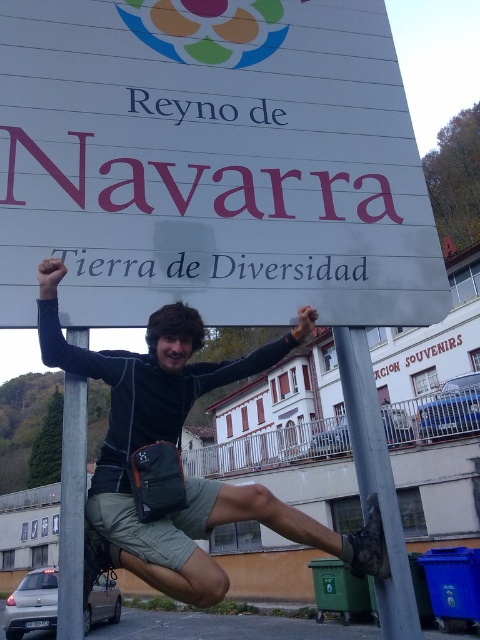
Question: Considering the real-world distances, which object is farthest from the white plastic sign at upper center?

Choices:
 (A) metallic pole at lower center
 (B) metallic pole at left

Answer: (B)

Question: Which point appears closest to the camera in this image?

Choices:
 (A) coord(83,513)
 (B) coord(90,141)
 (C) coord(360,428)
 (D) coord(357,532)

Answer: (A)

Question: Can you confirm if black fabric backpack at center is positioned above metallic pole at left?

Choices:
 (A) yes
 (B) no

Answer: (A)

Question: Can you confirm if black fabric backpack at center is thinner than metallic pole at lower center?

Choices:
 (A) no
 (B) yes

Answer: (A)

Question: Estimate the real-world distances between objects in this image. Which object is closer to the metallic pole at lower center?

Choices:
 (A) white plastic sign at upper center
 (B) black fabric backpack at center

Answer: (B)

Question: Can you confirm if black fabric backpack at center is bigger than metallic pole at left?

Choices:
 (A) yes
 (B) no

Answer: (A)